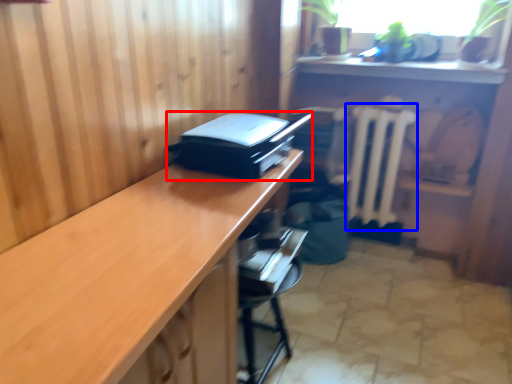
Question: Which point is further to the camera, printer (highlighted by a red box) or radiator (highlighted by a blue box)?

Choices:
 (A) printer
 (B) radiator

Answer: (B)